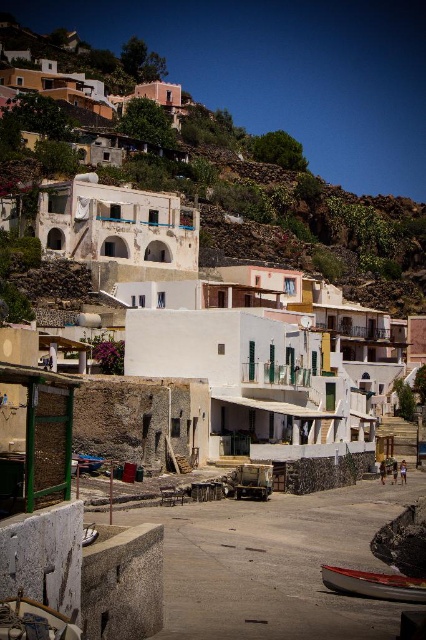
You are planning to deliver a package from the white stucco houses at upper center to the white wooden boat at lower right. Given that your delivery vehicle can only travel 300 feet before needing a recharge, what should you do?

The distance between the white stucco houses at upper center and the white wooden boat at lower right is 352.55 feet, which exceeds the vehicle capacity of 300 feet. Therefore, you need to recharge your vehicle before completing the delivery.

You are standing at the base of the hill in the coastal village and want to walk towards the village. There are two points marked on the path ahead of you. Which point is closer to you, point (276, 237) or point (331, 580)?

Point (276, 237) is closer to you because it is further to the viewer than point (331, 580), meaning it is nearer in the path ahead.